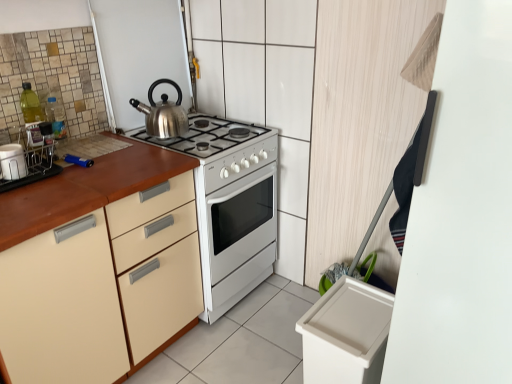
Locate an element on the screen. The image size is (512, 384). spots to the right of matte white container at left is located at coordinates (55, 184).